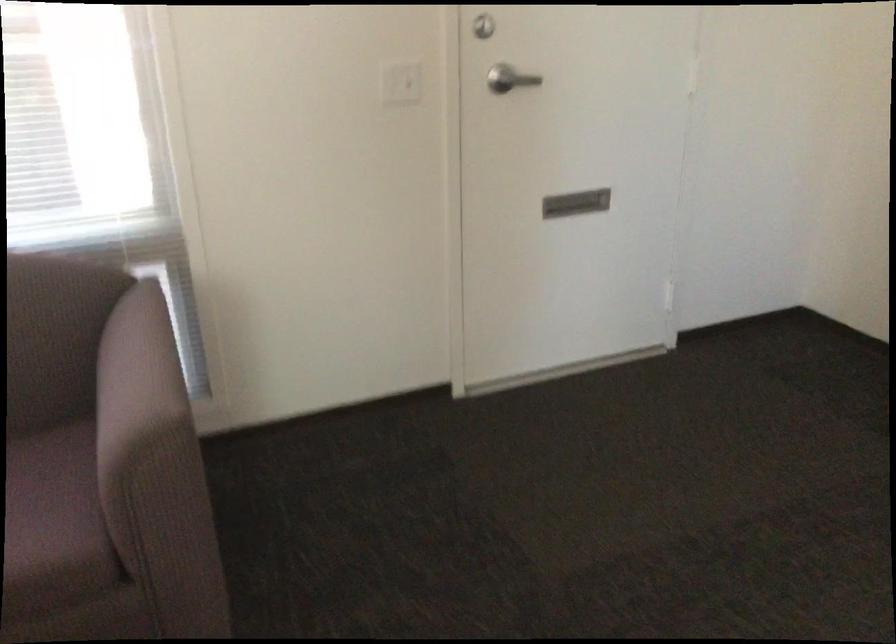
Find where to press the white light switch. Please return your answer as a coordinate pair (x, y).

(401, 82)